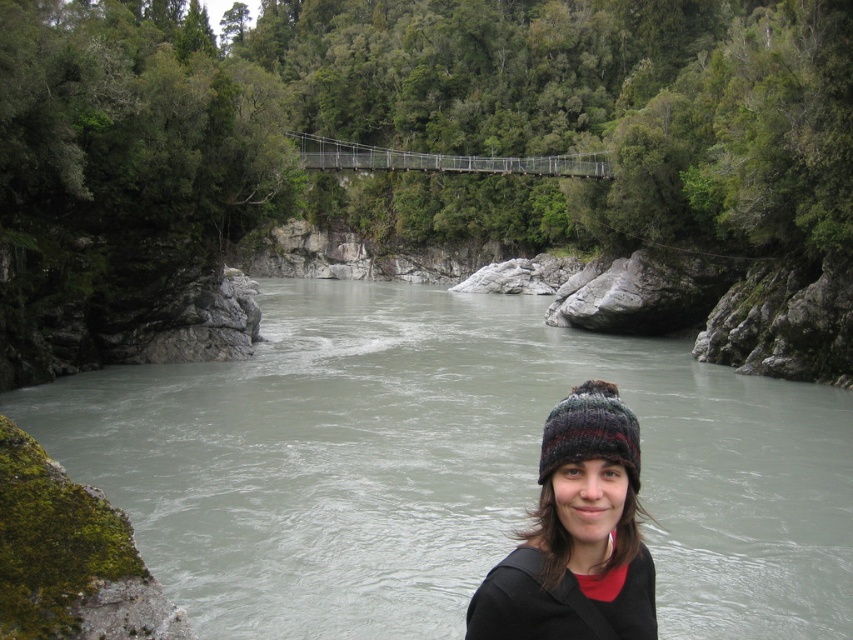
You are a hiker who has just arrived at the gorge and sees the black knitted hat at center and the multicolored knitted beanie at lower center. Which item is nearer to you?

The black knitted hat at center is closer to the viewer than the multicolored knitted beanie at lower center.

You are a hiker who wants to place a 2 meter long hiking pole between the black knitted hat at center and the multicolored knitted beanie at lower center. Can you fit the hiking pole between them without bending it?

The distance between the black knitted hat at center and the multicolored knitted beanie at lower center is 2.01 meters, so yes, the hiking pole can be placed between them without bending since the distance is slightly longer than the pole.

You are a hiker who wants to cross the suspension bridge in the background. You notice the gray smooth water at center and the multicolored knitted beanie at lower center. Which object is higher in elevation relative to the other?

The gray smooth water at center is taller than the multicolored knitted beanie at lower center, so the gray smooth water at center is higher in elevation.